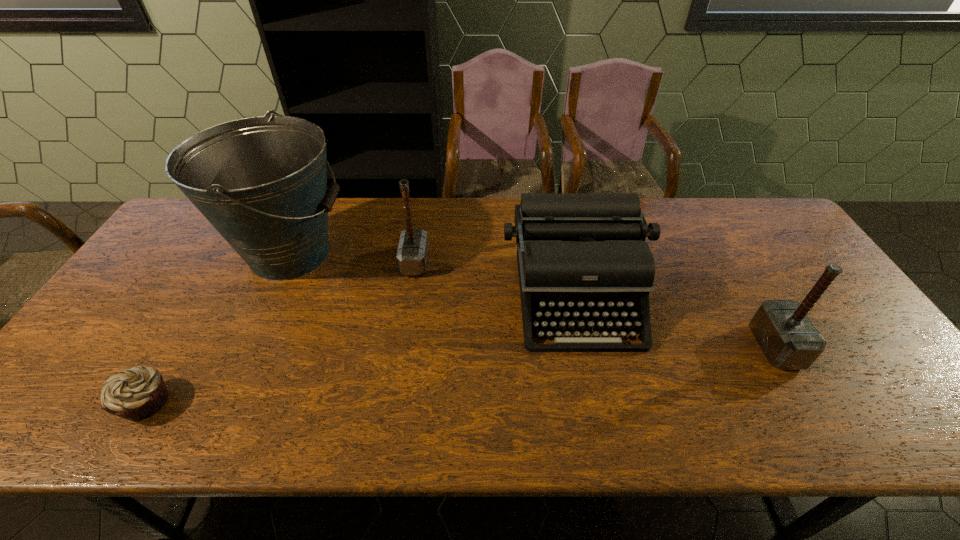
At what (x,y) coordinates should I click in order to perform the action: click on free space between the nearest object and the rightmost object. Please return your answer as a coordinate pair (x, y). The width and height of the screenshot is (960, 540). Looking at the image, I should click on (460, 375).

The width and height of the screenshot is (960, 540). What are the coordinates of `free spot between the shortest object and the farther hammer` in the screenshot? It's located at (280, 332).

Identify the location of vacant space in between the tallest object and the typewriter. The width and height of the screenshot is (960, 540). (434, 275).

Image resolution: width=960 pixels, height=540 pixels. Find the location of `vacant space that's between the nearer hammer and the fourth tallest object`. vacant space that's between the nearer hammer and the fourth tallest object is located at coordinates (676, 322).

You are a GUI agent. You are given a task and a screenshot of the screen. Output one action in this format:
    pyautogui.click(x=<x>, y=<y>)
    Task: Click on the free space between the muffin and the bucket
    This screenshot has width=960, height=540.
    Given the screenshot: What is the action you would take?
    pyautogui.click(x=218, y=328)

Identify the location of vacant area that lies between the bucket and the third object from left to right. This screenshot has width=960, height=540. (352, 258).

The image size is (960, 540). I want to click on free space between the nearer hammer and the nearest object, so (x=460, y=375).

I want to click on free space that is in between the right hammer and the nearest object, so click(460, 375).

Locate an element on the screen. This screenshot has height=540, width=960. empty location between the typewriter and the bucket is located at coordinates (434, 275).

Locate which object ranks second in proximity to the third object from left to right. Please provide its 2D coordinates. Your answer should be formatted as a tuple, i.e. [(x, y)], where the tuple contains the x and y coordinates of a point satisfying the conditions above.

[(580, 255)]